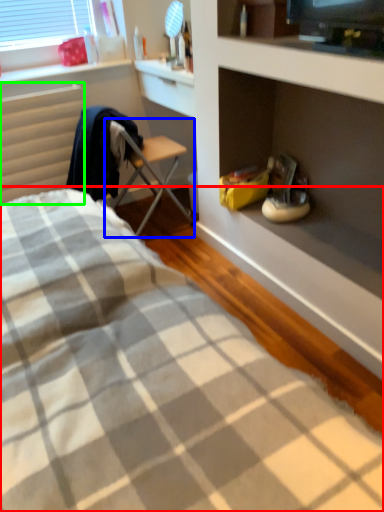
Question: Considering the real-world distances, which object is farthest from bed (highlighted by a red box)? chair (highlighted by a blue box) or radiator (highlighted by a green box)?

Choices:
 (A) chair
 (B) radiator

Answer: (A)